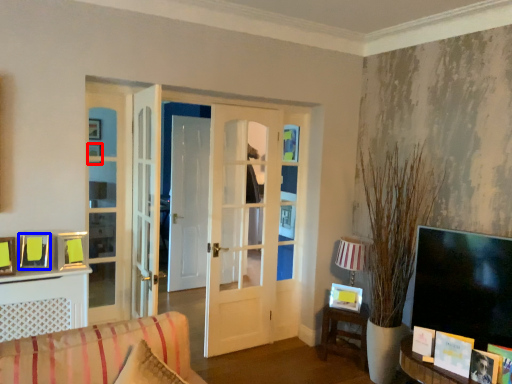
Question: Which point is closer to the camera, picture frame (highlighted by a red box) or picture frame (highlighted by a blue box)?

Choices:
 (A) picture frame
 (B) picture frame

Answer: (B)